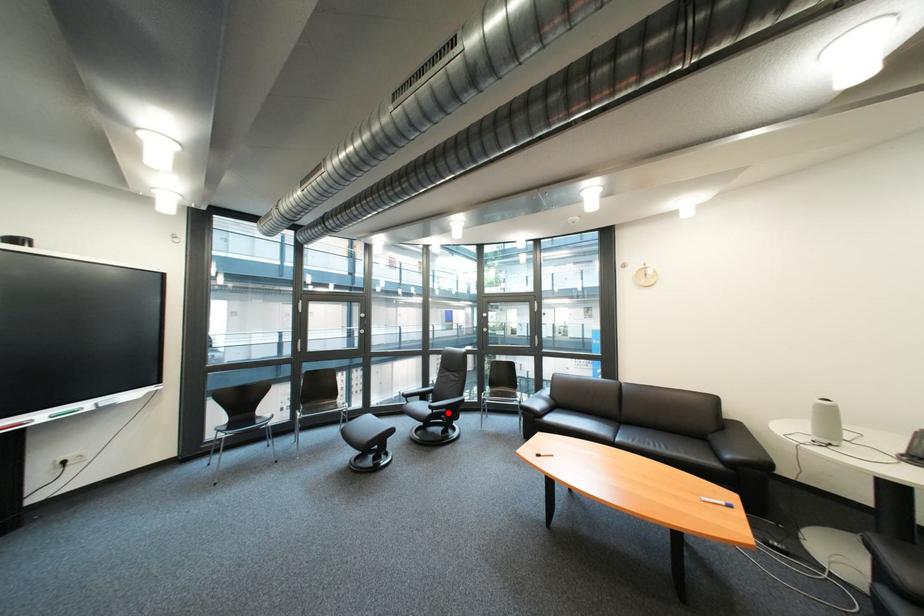
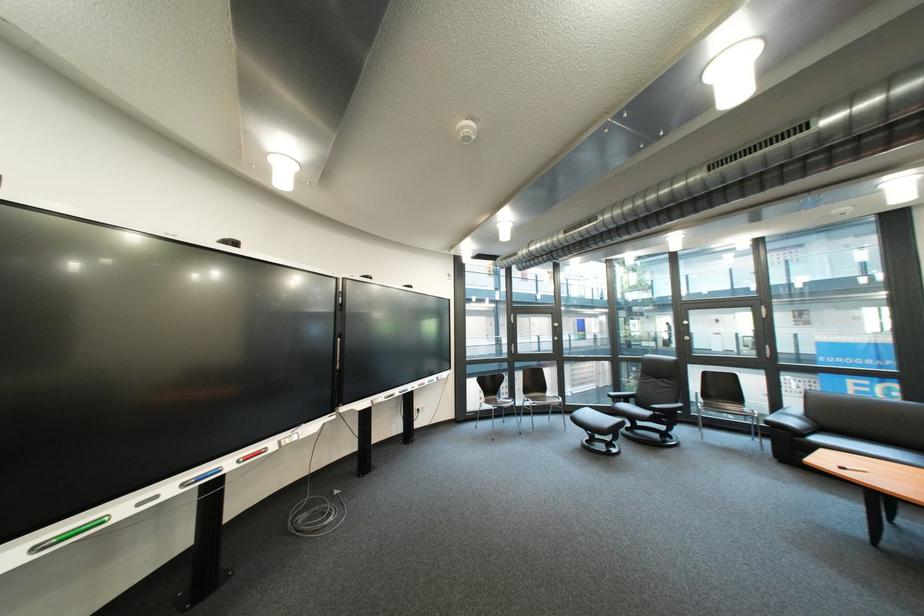
Where in the second image is the point corresponding to the highlighted location from the first image?

(670, 415)